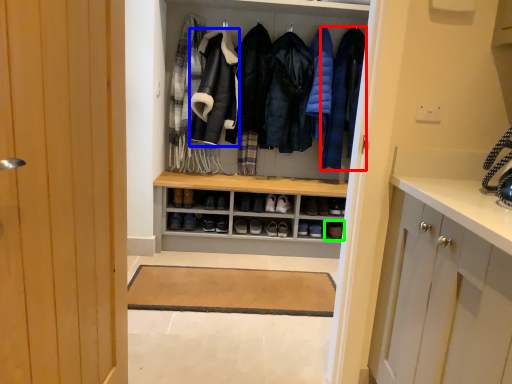
Question: Which object is positioned closest to clothing (highlighted by a red box)? Select from garment (highlighted by a blue box) and footwear (highlighted by a green box).

Choices:
 (A) garment
 (B) footwear

Answer: (A)